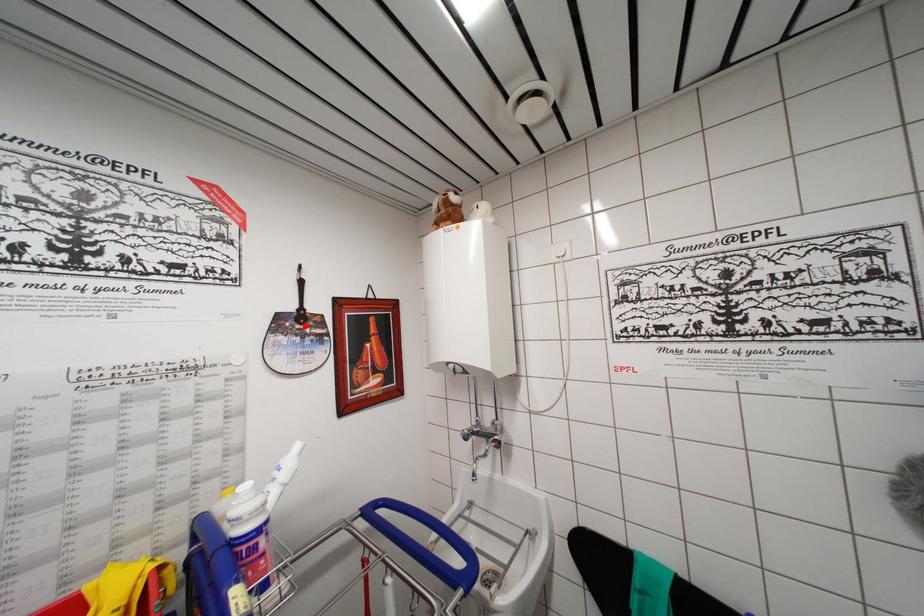
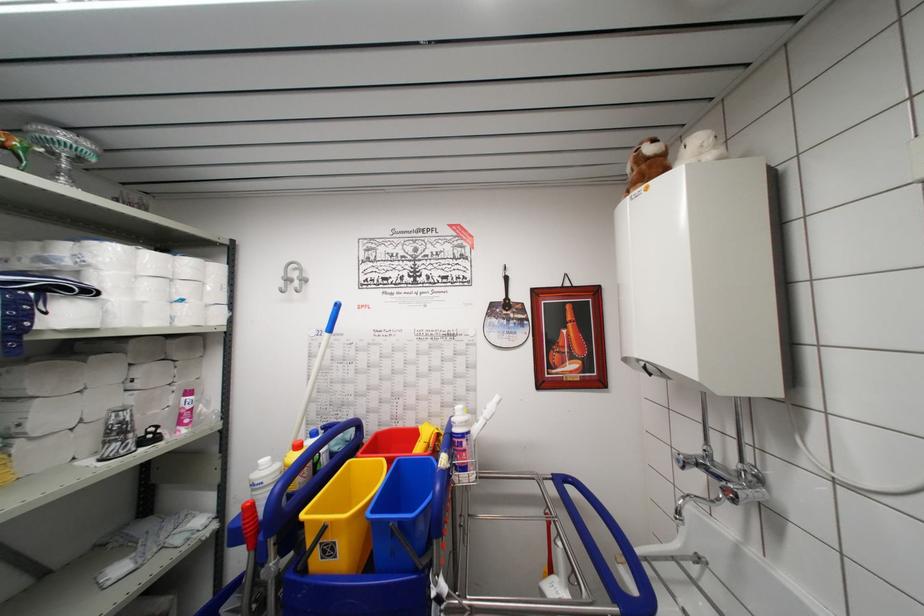
Locate, in the second image, the point that corresponds to the highlighted location in the first image.

(511, 313)